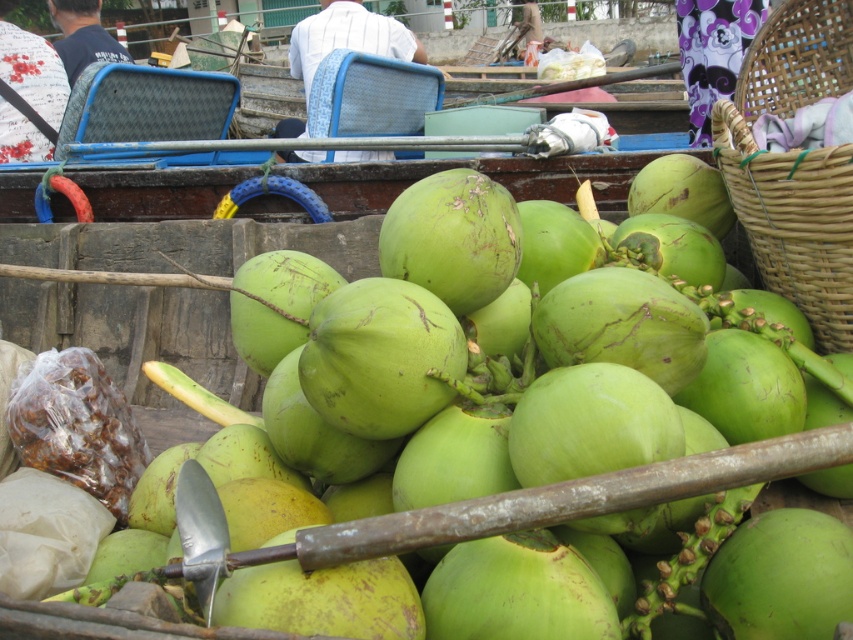
Question: Which object is closer to the camera taking this photo?

Choices:
 (A) green rough coconut at center
 (B) woven bamboo basket at right

Answer: (A)

Question: Which point is closer to the camera?

Choices:
 (A) woven bamboo basket at right
 (B) green rough coconut at center

Answer: (B)

Question: Is green rough coconut at center to the right of woven bamboo basket at right from the viewer's perspective?

Choices:
 (A) no
 (B) yes

Answer: (A)

Question: Can you confirm if green rough coconut at center is thinner than woven bamboo basket at right?

Choices:
 (A) yes
 (B) no

Answer: (B)

Question: Which point is farther to the camera?

Choices:
 (A) green rough coconut at center
 (B) woven bamboo basket at right

Answer: (B)

Question: Is green rough coconut at center bigger than woven bamboo basket at right?

Choices:
 (A) no
 (B) yes

Answer: (B)